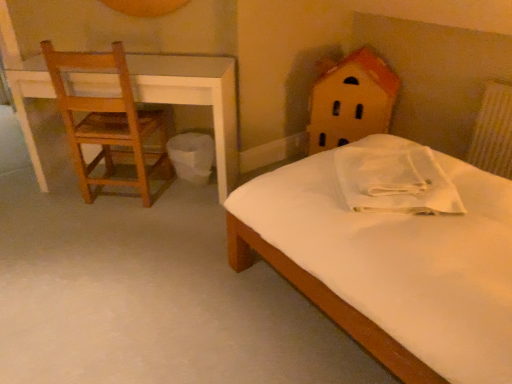
Locate an element on the screen. This screenshot has width=512, height=384. free location in front of white plastic trash bin at lower center is located at coordinates (182, 209).